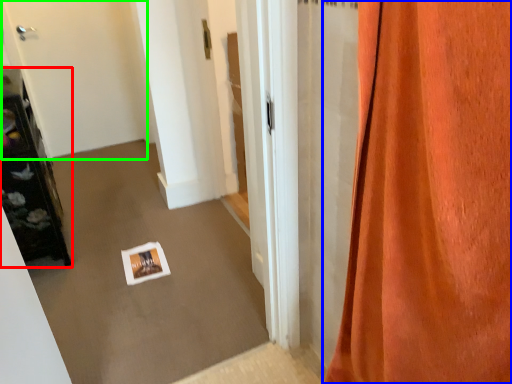
Question: Based on their relative distances, which object is farther from furniture (highlighted by a red box)? Choose from curtain (highlighted by a blue box) and door (highlighted by a green box).

Choices:
 (A) curtain
 (B) door

Answer: (A)